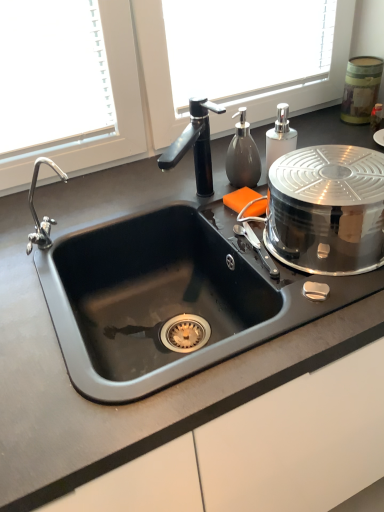
The image size is (384, 512). In order to click on free space above polished stainless steel lid at right, which ranks as the 1th appliance in front-to-back order (from a real-world perspective) in this screenshot , I will do `click(336, 170)`.